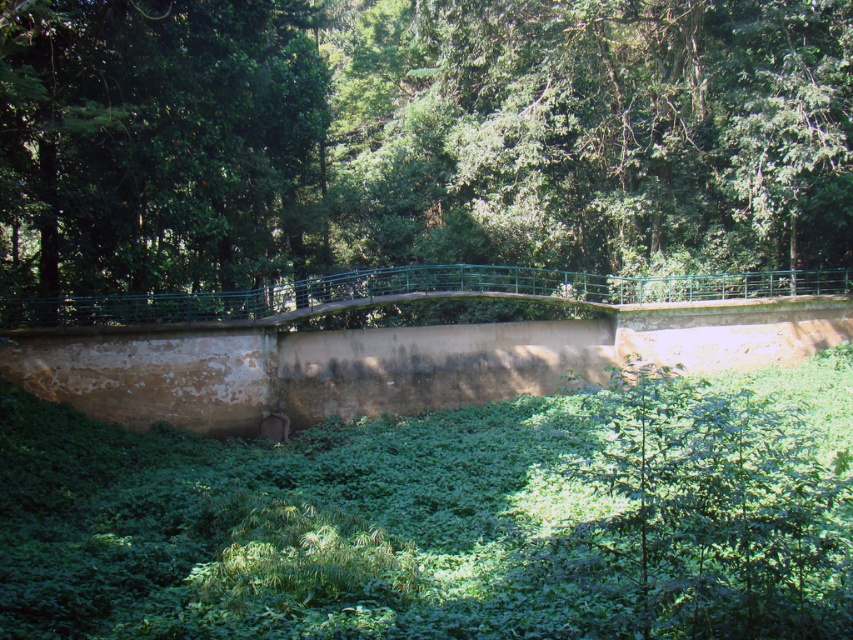
Question: Is green leafy vegetation at center thinner than green leafy tree at center?

Choices:
 (A) yes
 (B) no

Answer: (B)

Question: Does green metallic bridge at center appear on the right side of green leafy tree at center?

Choices:
 (A) no
 (B) yes

Answer: (B)

Question: Is green leafy vegetation at center wider than green leafy tree at center?

Choices:
 (A) no
 (B) yes

Answer: (B)

Question: Which object is farther from the camera taking this photo?

Choices:
 (A) green leafy vegetation at center
 (B) green metallic bridge at center

Answer: (B)

Question: Which object appears closest to the camera in this image?

Choices:
 (A) green metallic bridge at center
 (B) green leafy tree at center

Answer: (B)

Question: Which object is farther from the camera taking this photo?

Choices:
 (A) green leafy vegetation at center
 (B) green metallic bridge at center

Answer: (B)